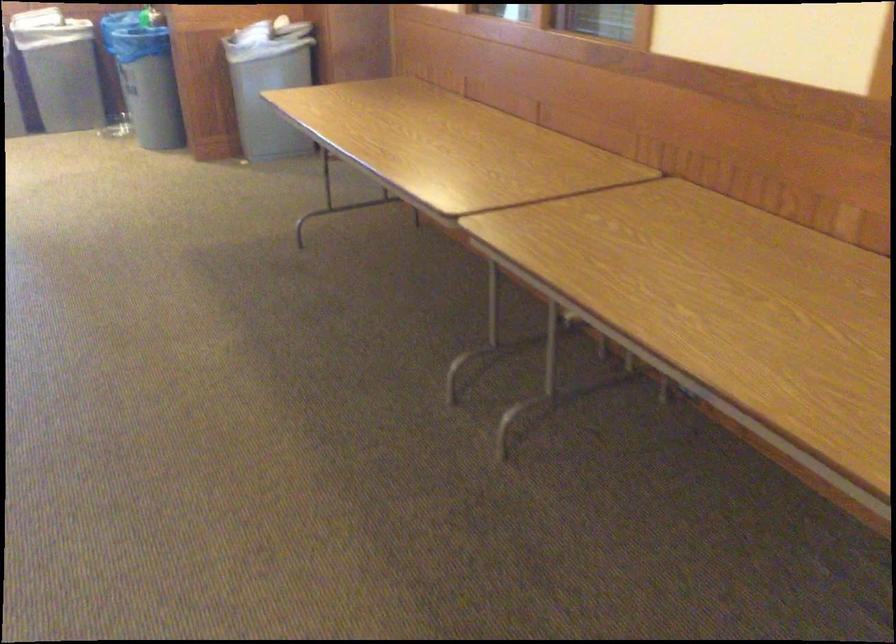
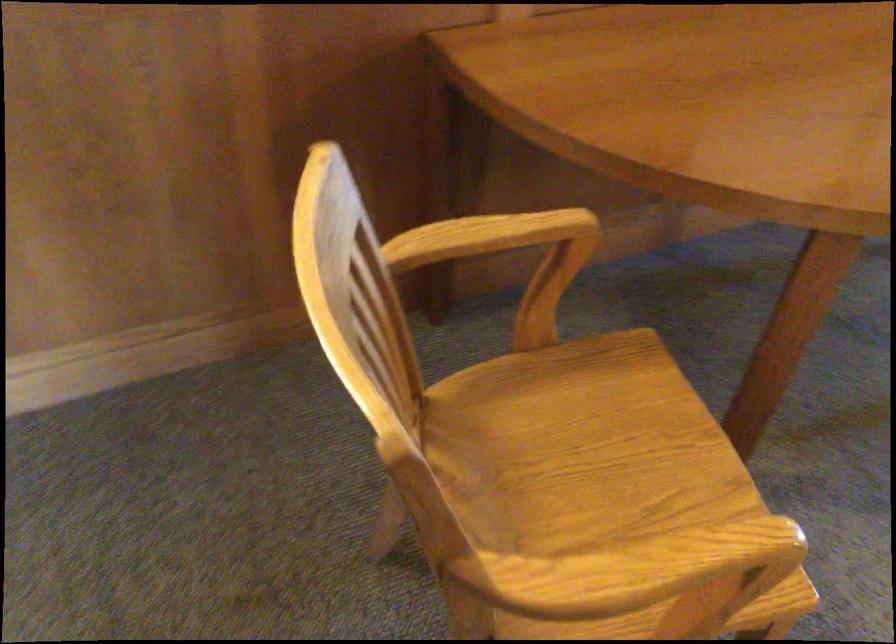
First-person continuous shooting, in which direction is the camera rotating?

The rotation direction of the camera is left-down.